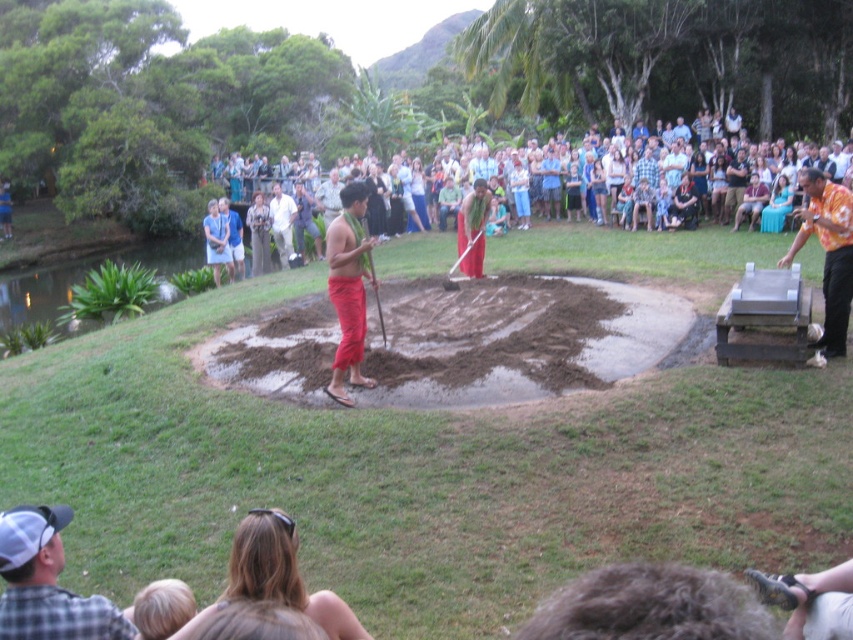
Is light blue cotton shirt at upper center positioned before green leafy pond at lower left?

Yes, it is in front of green leafy pond at lower left.

Between light blue cotton shirt at upper center and green leafy pond at lower left, which one has more height?

light blue cotton shirt at upper center

Between point (840, 179) and point (177, 259), which one is positioned in front?

Point (840, 179)

The image size is (853, 640). Find the location of `light blue cotton shirt at upper center`. light blue cotton shirt at upper center is located at coordinates point(822,211).

Who is more forward, (354, 348) or (602, 177)?

Point (354, 348) is in front.

Is matte red loincloth at center smaller than denim shorts at center?

Yes.

Who is more distant from viewer, (351, 376) or (598, 195)?

The point (598, 195) is more distant.

Identify the location of matte red loincloth at center. (347, 289).

Does green leafy pond at lower left have a larger size compared to white shirt at center?

Yes, green leafy pond at lower left is bigger than white shirt at center.

Can you confirm if green leafy pond at lower left is positioned below white shirt at center?

Yes.

Does point (73, 280) come behind point (289, 252)?

Yes, point (73, 280) is behind point (289, 252).

Where is `green leafy pond at lower left`? Image resolution: width=853 pixels, height=640 pixels. green leafy pond at lower left is located at coordinates (83, 282).